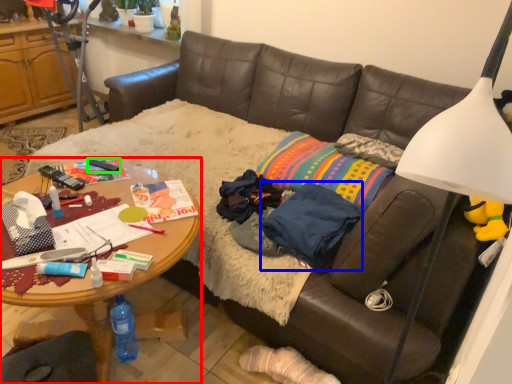
Question: Which object is the farthest from desk (highlighted by a red box)? Choose among these: clothing (highlighted by a blue box) or remote control (highlighted by a green box).

Choices:
 (A) clothing
 (B) remote control

Answer: (A)